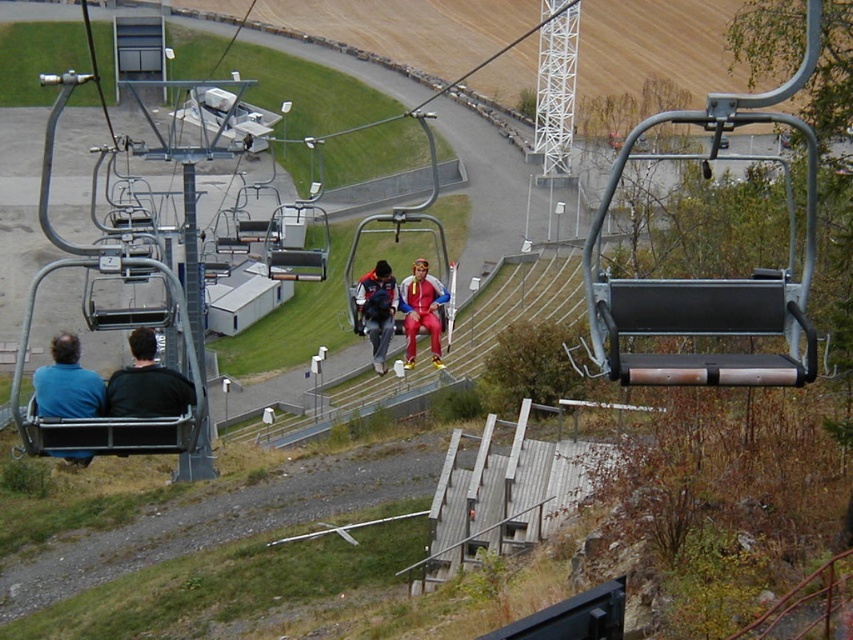
Question: Which of the following is the closest to the observer?

Choices:
 (A) (433, 289)
 (B) (57, 401)

Answer: (B)

Question: Which point is farther from the camera taking this photo?

Choices:
 (A) (410, 289)
 (B) (73, 346)
 (C) (370, 342)

Answer: (C)

Question: Can you confirm if dark gray fabric jacket at left is wider than matte gray backpack at center?

Choices:
 (A) yes
 (B) no

Answer: (B)

Question: Can you confirm if matte black seats at lower left is positioned to the left of blue fabric jacket at left?

Choices:
 (A) yes
 (B) no

Answer: (B)

Question: Which point is farther to the camera?

Choices:
 (A) [x=427, y=326]
 (B) [x=379, y=326]
 (C) [x=135, y=349]

Answer: (B)

Question: Is matte black seats at lower left thinner than blue fabric jacket at left?

Choices:
 (A) no
 (B) yes

Answer: (B)